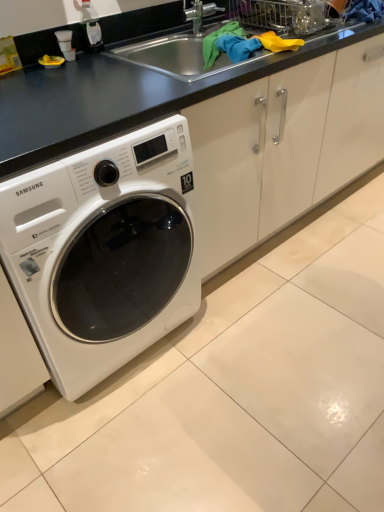
Question: Which is correct: black matte counter top at upper center is inside white glossy washing machine at lower left, or outside of it?

Choices:
 (A) outside
 (B) inside

Answer: (A)

Question: In terms of width, does black matte counter top at upper center look wider or thinner when compared to white glossy washing machine at lower left?

Choices:
 (A) thin
 (B) wide

Answer: (A)

Question: Which of these objects is positioned farthest from the clear plastic bottle at upper left?

Choices:
 (A) white glossy washing machine at lower left
 (B) black matte counter top at upper center

Answer: (A)

Question: Which of these objects is positioned closest to the black matte counter top at upper center?

Choices:
 (A) clear plastic bottle at upper left
 (B) white glossy washing machine at lower left

Answer: (B)